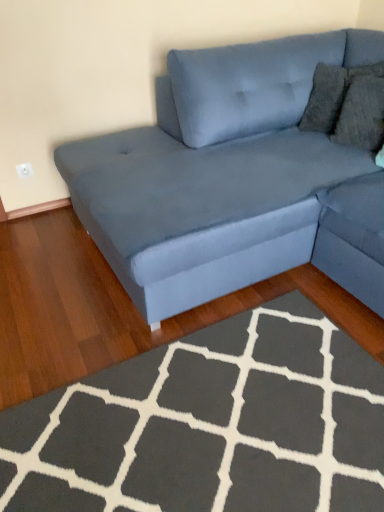
This screenshot has height=512, width=384. Identify the location of free point above dark gray plush rug at lower center (from a real-world perspective). (228, 409).